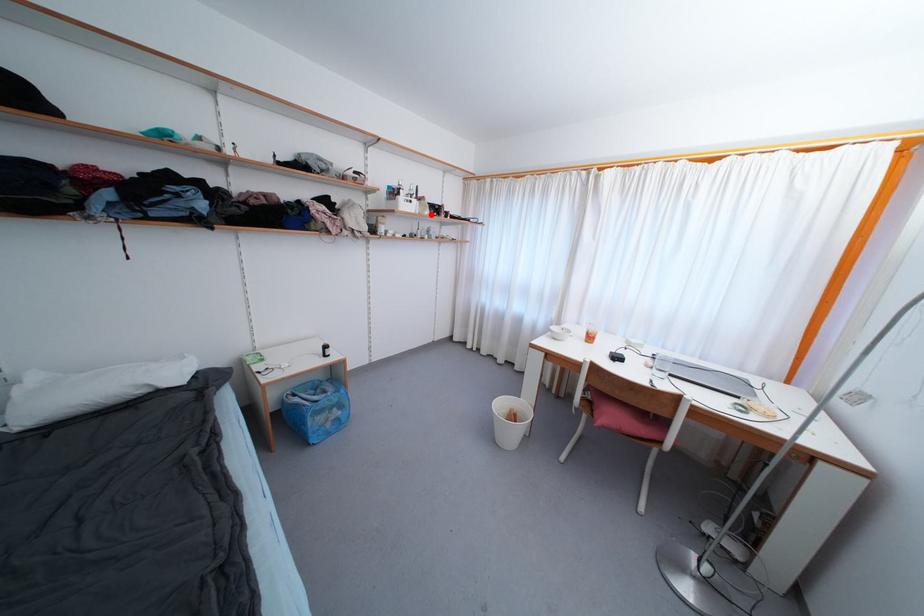
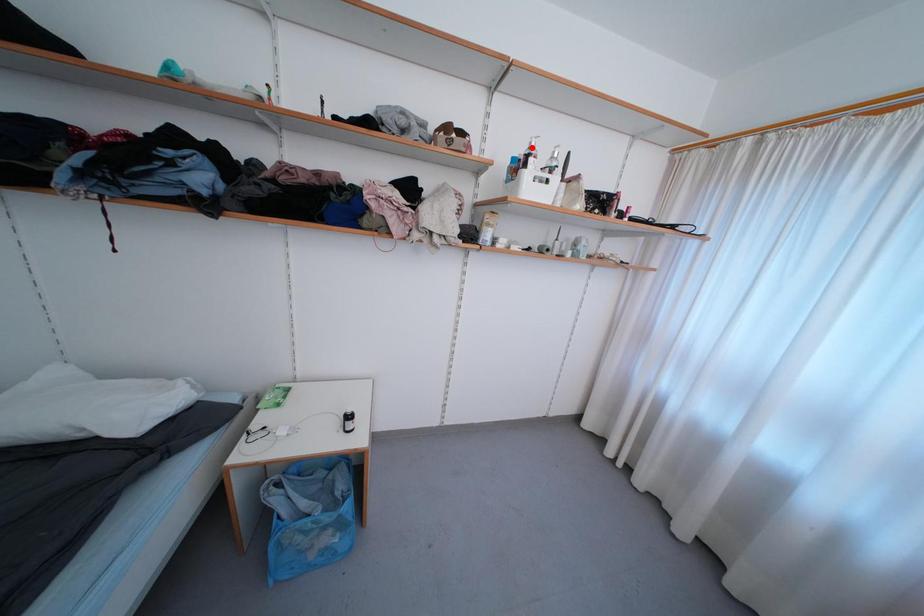
I am providing you with two images of the same scene from different viewpoints. A red point is marked on the first image and another point is marked on the second image. Does the point marked in image1 correspond to the same location as the one in image2?

No